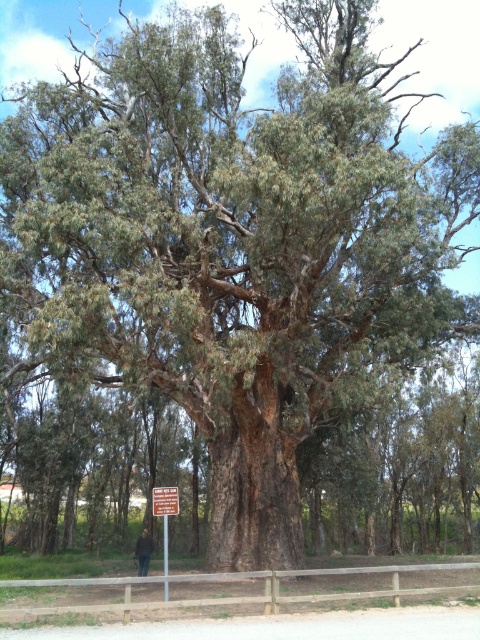
You are hiking in a forest and come across a tree with a red plastic sign at center and a brown leather jacket at center. According to their positions, which object is to the left of the other?

The brown leather jacket at center is to the left of the red plastic sign at center because the red plastic sign at center is positioned on the right side of brown leather jacket at center.

In the scene shown: You are standing at the base of the large eucalyptus tree and see both the brown wooden signpost at center and the brown leather jacket at center. If you want to reach the jacket first, which object should you move towards first?

You should move towards the brown leather jacket at center first because it is closer to you than the brown wooden signpost at center, which is 3.01 meters away.